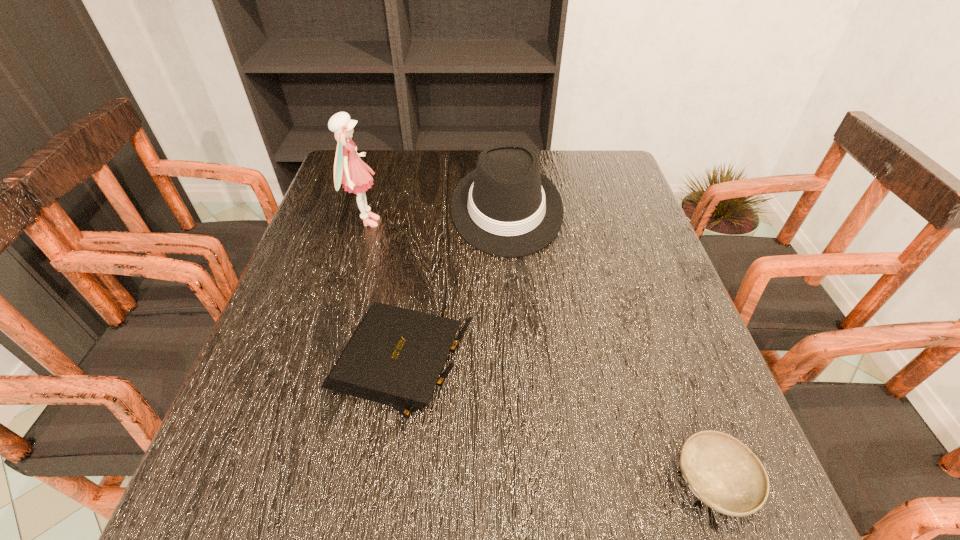
Identify the location of unoccupied area between the shortest object and the third tallest object. The width and height of the screenshot is (960, 540). (557, 425).

The height and width of the screenshot is (540, 960). What are the coordinates of `free spot between the second shortest object and the rightmost object` in the screenshot? It's located at (557, 425).

Select which object appears as the third closest to the bowl. Please provide its 2D coordinates. Your answer should be formatted as a tuple, i.e. [(x, y)], where the tuple contains the x and y coordinates of a point satisfying the conditions above.

[(349, 170)]

What are the coordinates of `object that ranks as the closest to the rightmost object` in the screenshot? It's located at (395, 356).

Find the location of a particular element. Image resolution: width=960 pixels, height=540 pixels. free spot that satisfies the following two spatial constraints: 1. on the front-facing side of the second nearest object; 2. on the left side of the tallest object is located at coordinates (323, 369).

Identify the location of free space in the image that satisfies the following two spatial constraints: 1. on the front-facing side of the doll; 2. on the left side of the rightmost object. This screenshot has height=540, width=960. (289, 482).

Image resolution: width=960 pixels, height=540 pixels. Identify the location of vacant region that satisfies the following two spatial constraints: 1. on the front-facing side of the third shortest object; 2. on the front-facing side of the doll. (508, 222).

At what (x,y) coordinates should I click in order to perform the action: click on free space that satisfies the following two spatial constraints: 1. on the front-facing side of the fedora; 2. on the front-facing side of the tallest object. Please return your answer as a coordinate pair (x, y). The width and height of the screenshot is (960, 540). Looking at the image, I should click on (508, 222).

At what (x,y) coordinates should I click in order to perform the action: click on vacant space that satisfies the following two spatial constraints: 1. on the front-facing side of the tallest object; 2. on the right side of the router. Please return your answer as a coordinate pair (x, y). This screenshot has height=540, width=960. Looking at the image, I should click on (323, 369).

This screenshot has height=540, width=960. Find the location of `vacant space that satisfies the following two spatial constraints: 1. on the front-facing side of the bowl; 2. on the left side of the third shortest object`. vacant space that satisfies the following two spatial constraints: 1. on the front-facing side of the bowl; 2. on the left side of the third shortest object is located at coordinates (526, 482).